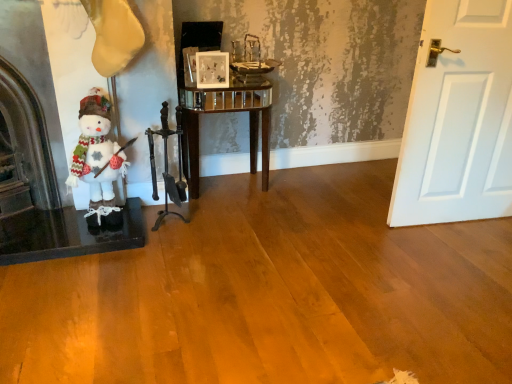
At what (x,y) coordinates should I click in order to perform the action: click on vacant space underneath dark brown polished wood fireplace tools at center (from a real-world perspective). Please return your answer as a coordinate pair (x, y). Looking at the image, I should click on (167, 227).